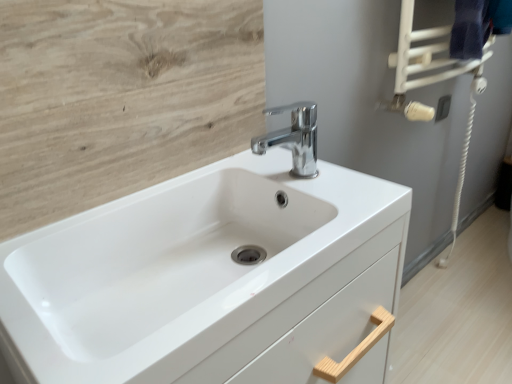
Question: From a real-world perspective, relative to chrome metallic faucet at center, is light wood/texture at upper left vertically above or below?

Choices:
 (A) above
 (B) below

Answer: (A)

Question: Based on their sizes in the image, would you say light wood/texture at upper left is bigger or smaller than chrome metallic faucet at center?

Choices:
 (A) big
 (B) small

Answer: (A)

Question: Based on their relative distances, which object is farther from the light wood/texture at upper left?

Choices:
 (A) chrome metallic faucet at center
 (B) dark blue fabric towel bar at upper right
 (C) white glossy sink at center

Answer: (B)

Question: Which object is the farthest from the dark blue fabric towel bar at upper right?

Choices:
 (A) white glossy sink at center
 (B) chrome metallic faucet at center
 (C) light wood/texture at upper left

Answer: (A)